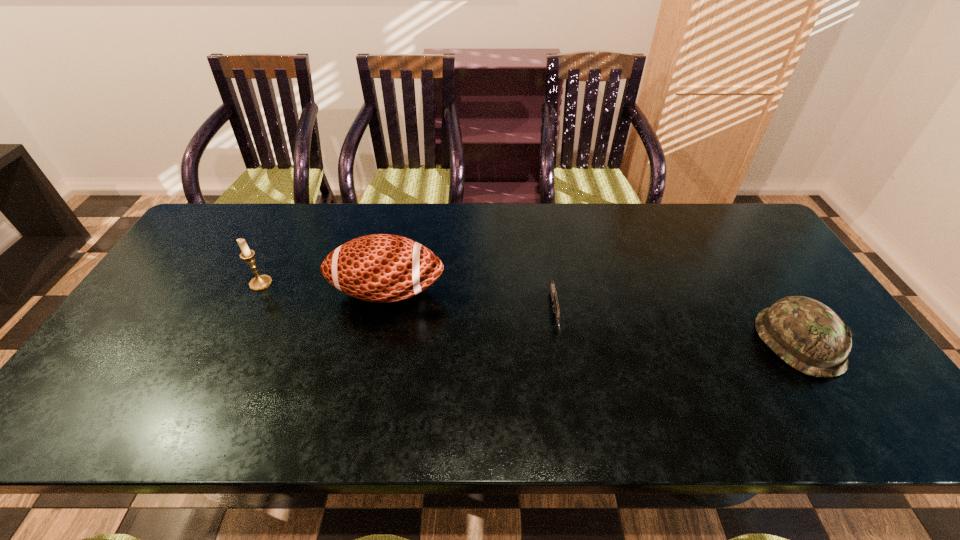
Identify the location of object at the right edge. (806, 334).

You are a GUI agent. You are given a task and a screenshot of the screen. Output one action in this format:
    pyautogui.click(x=<x>, y=<y>)
    Task: Click on the blank area at the far edge
    This screenshot has width=960, height=540.
    Given the screenshot: What is the action you would take?
    pyautogui.click(x=638, y=225)

Find the location of a particular element. free point at the near edge is located at coordinates (560, 410).

Image resolution: width=960 pixels, height=540 pixels. I want to click on vacant space at the left edge of the desktop, so click(142, 320).

Find the location of a particular element. This screenshot has width=960, height=540. free space between the leftmost object and the rightmost object is located at coordinates (530, 313).

Identify the location of empty space between the second shortest object and the third object from left to right. (677, 328).

This screenshot has width=960, height=540. In order to click on vacant area that lies between the shortest object and the third object from right to left in this screenshot , I will do `click(471, 303)`.

The width and height of the screenshot is (960, 540). Find the location of `free point between the candle holder and the football`. free point between the candle holder and the football is located at coordinates (324, 288).

What are the coordinates of `empty space that is in between the shortest object and the second object from left to right` in the screenshot? It's located at pos(471,303).

Locate an element on the screen. unoccupied position between the football and the gun is located at coordinates (471, 303).